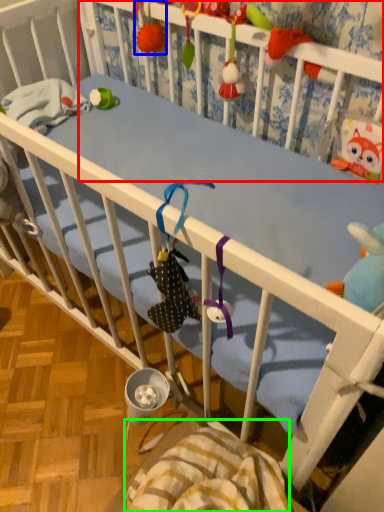
Question: Which object is the closest to the infant bed (highlighted by a red box)? Choose among these: toy (highlighted by a blue box) or blanket (highlighted by a green box).

Choices:
 (A) toy
 (B) blanket

Answer: (A)